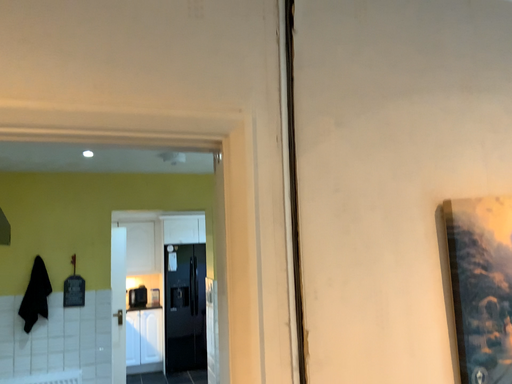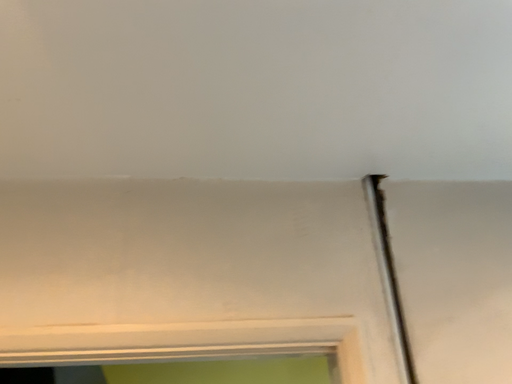
Question: Which way did the camera rotate in the video?

Choices:
 (A) rotated right
 (B) rotated left

Answer: (B)